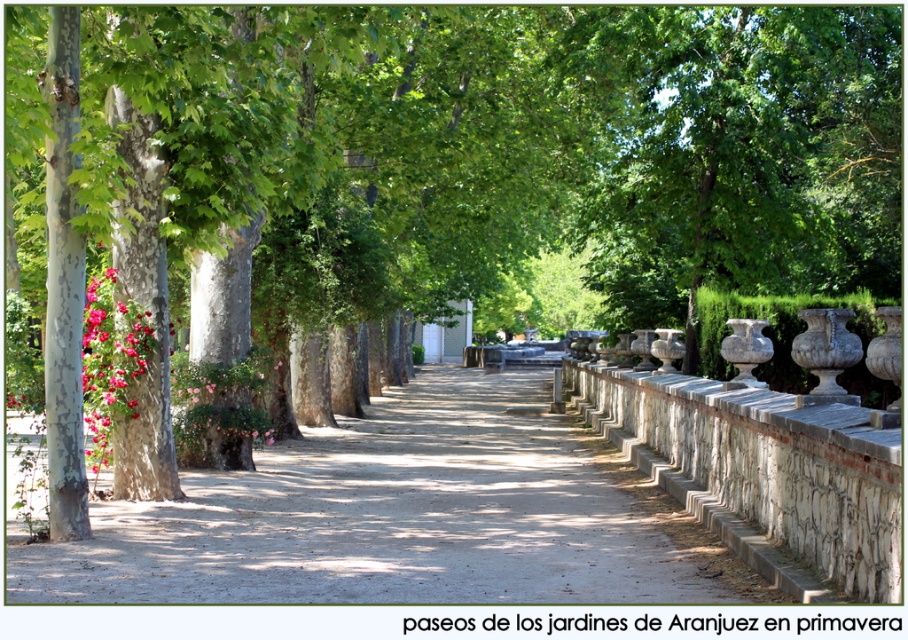
Question: Which object appears farthest from the camera in this image?

Choices:
 (A) pink matte flowers at left
 (B) dirt path at center

Answer: (A)

Question: Does dirt path at center have a larger size compared to pink matte flowers at left?

Choices:
 (A) no
 (B) yes

Answer: (B)

Question: In this image, where is dirt path at center located relative to pink matte flowers at left?

Choices:
 (A) left
 (B) right

Answer: (B)

Question: Is dirt path at center thinner than pink matte flowers at left?

Choices:
 (A) yes
 (B) no

Answer: (B)

Question: Which point is closer to the camera?

Choices:
 (A) dirt path at center
 (B) pink matte flowers at left

Answer: (A)